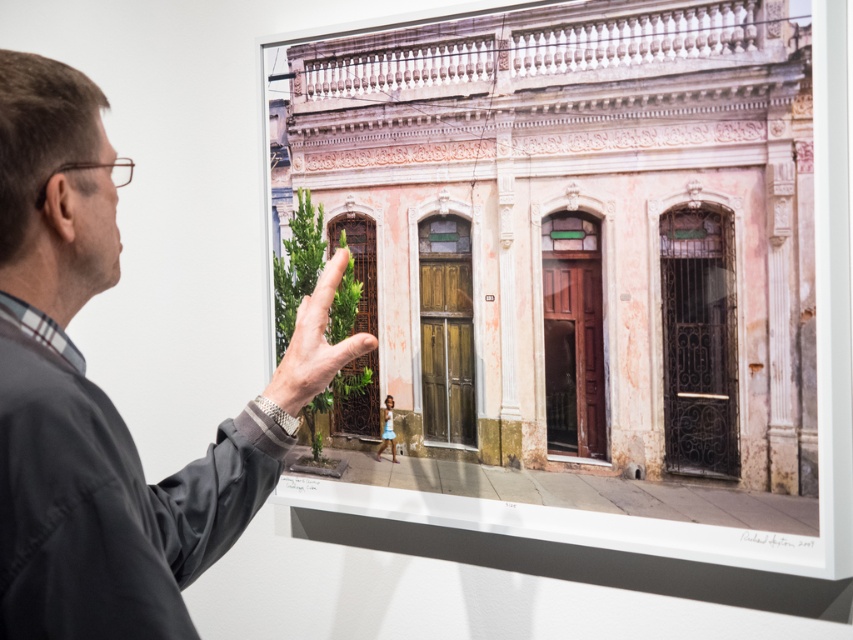
Question: Among these objects, which one is farthest from the camera?

Choices:
 (A) matte pink building at center
 (B) gray fabric shirt at upper left

Answer: (A)

Question: Can you confirm if matte pink building at center is thinner than gray fabric shirt at upper left?

Choices:
 (A) yes
 (B) no

Answer: (B)

Question: Where is matte pink building at center located in relation to gray fabric shirt at upper left in the image?

Choices:
 (A) below
 (B) above

Answer: (B)

Question: Is matte pink building at center bigger than gray fabric shirt at upper left?

Choices:
 (A) yes
 (B) no

Answer: (A)